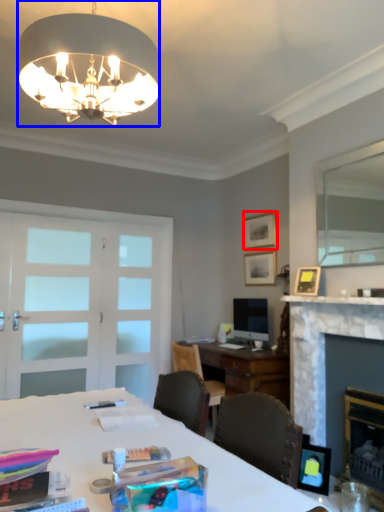
Question: Among these objects, which one is farthest to the camera, picture frame (highlighted by a red box) or lamp (highlighted by a blue box)?

Choices:
 (A) picture frame
 (B) lamp

Answer: (A)